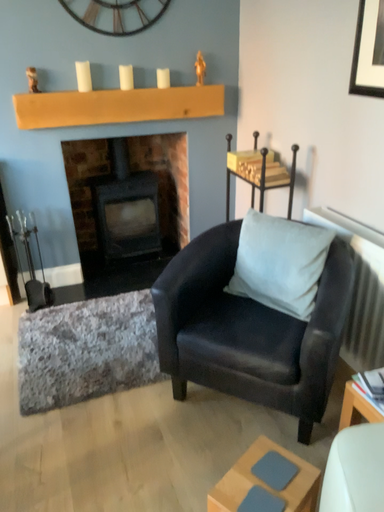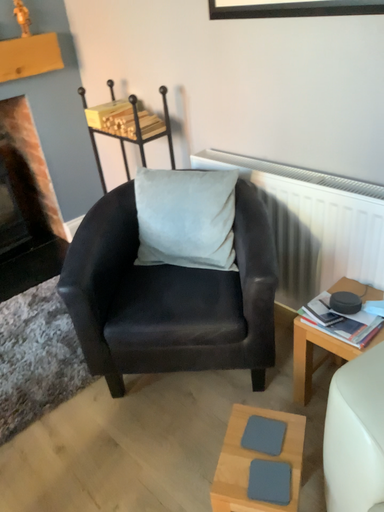
Question: How did the camera likely rotate when shooting the video?

Choices:
 (A) rotated right
 (B) rotated left

Answer: (A)